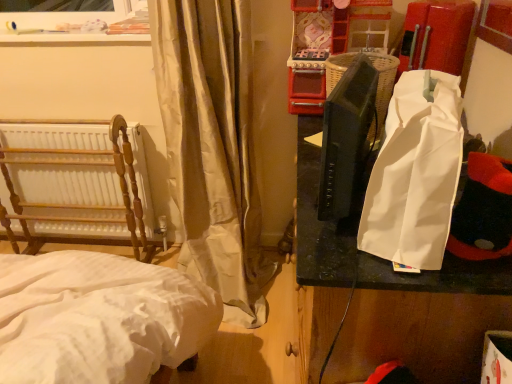
Question: From the image's perspective, is silky beige curtain at left located above or below white paper bag at right?

Choices:
 (A) above
 (B) below

Answer: (A)

Question: From a real-world perspective, is silky beige curtain at left physically located above or below white paper bag at right?

Choices:
 (A) above
 (B) below

Answer: (A)

Question: Which of these objects is positioned farthest from the silky beige curtain at left?

Choices:
 (A) white paper bag at right
 (B) white paper bag at right
 (C) wooden radiator at left

Answer: (B)

Question: Based on their relative distances, which object is farther from the white paper bag at right?

Choices:
 (A) wooden radiator at left
 (B) silky beige curtain at left
 (C) white paper bag at right

Answer: (A)